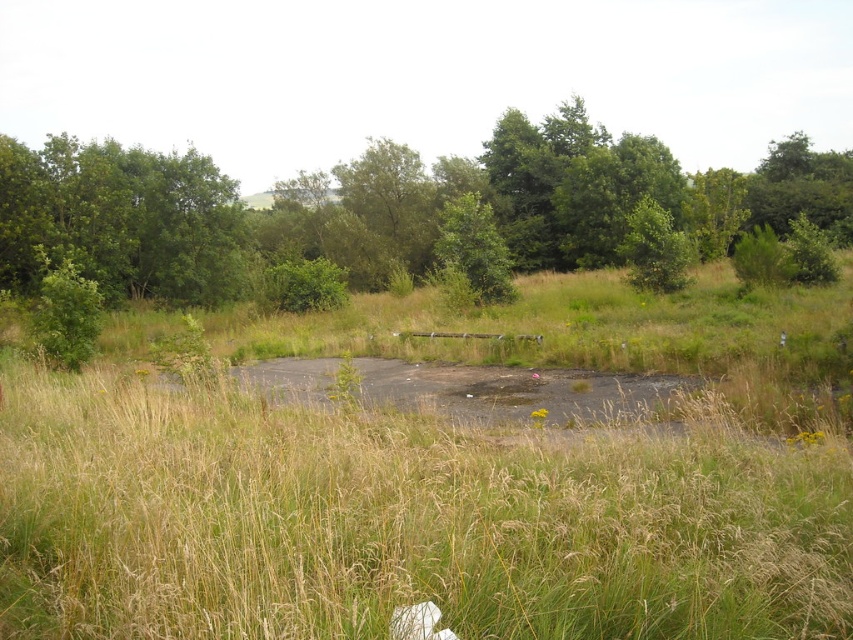
Question: Which point appears closest to the camera in this image?

Choices:
 (A) (183, 278)
 (B) (482, 289)

Answer: (B)

Question: Is green leafy tree at upper left bigger than green leafy tree at center?

Choices:
 (A) no
 (B) yes

Answer: (B)

Question: Can you confirm if green leafy tree at upper left is smaller than green leafy tree at center?

Choices:
 (A) no
 (B) yes

Answer: (A)

Question: Which point is farther to the camera?

Choices:
 (A) (482, 266)
 (B) (579, 164)

Answer: (B)

Question: Is green leafy tree at upper left closer to the viewer compared to green leafy tree at center?

Choices:
 (A) no
 (B) yes

Answer: (A)